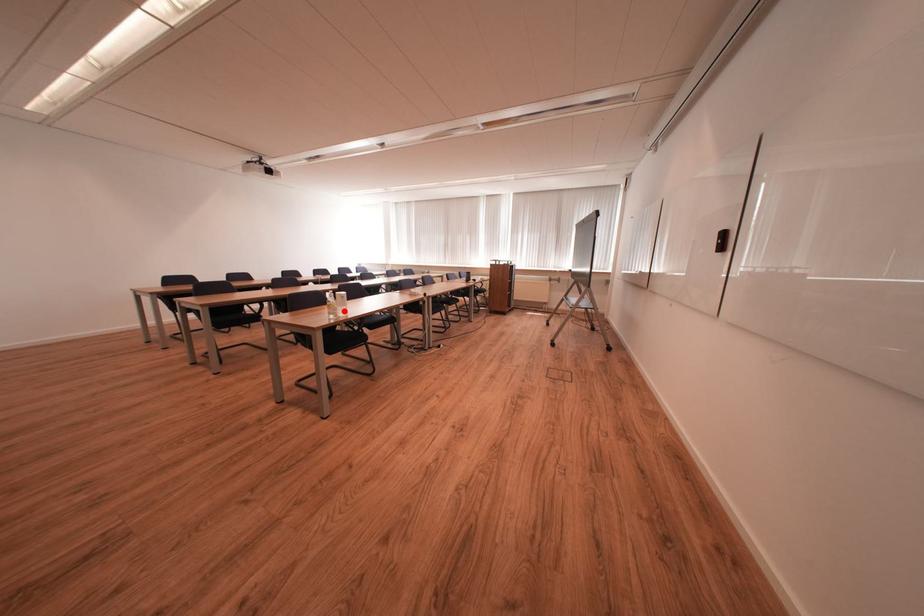
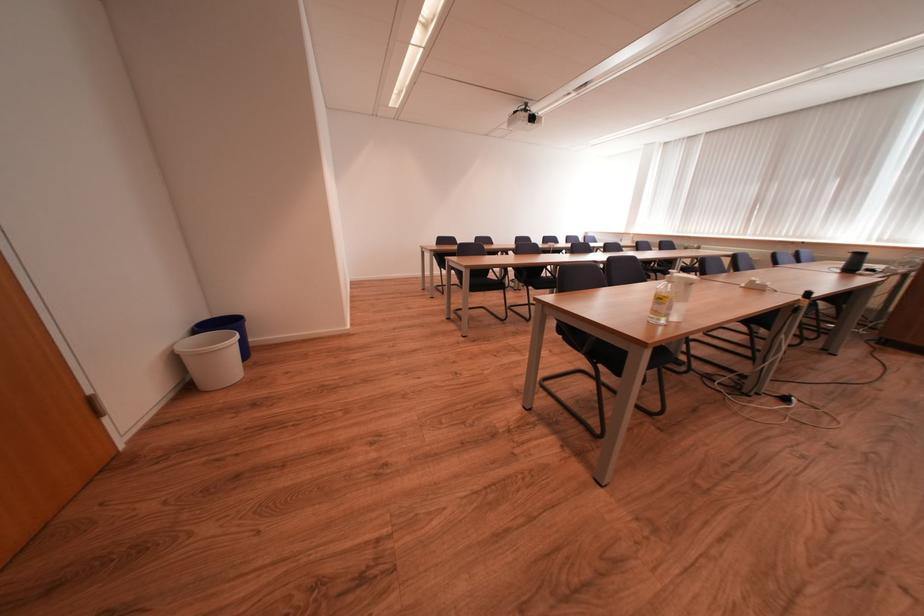
The point at the highlighted location is marked in the first image. Where is the corresponding point in the second image?

(678, 310)